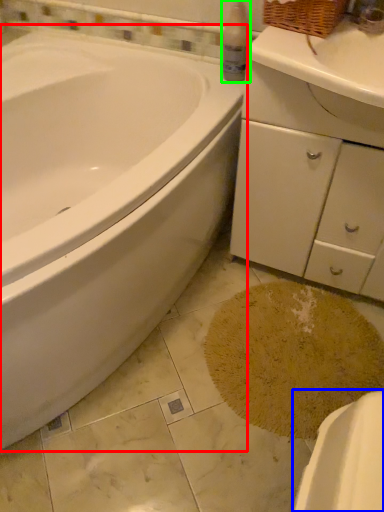
Question: Which object is positioned farthest from bathtub (highlighted by a red box)? Select from porcelain (highlighted by a blue box) and cleaning product (highlighted by a green box).

Choices:
 (A) porcelain
 (B) cleaning product

Answer: (A)